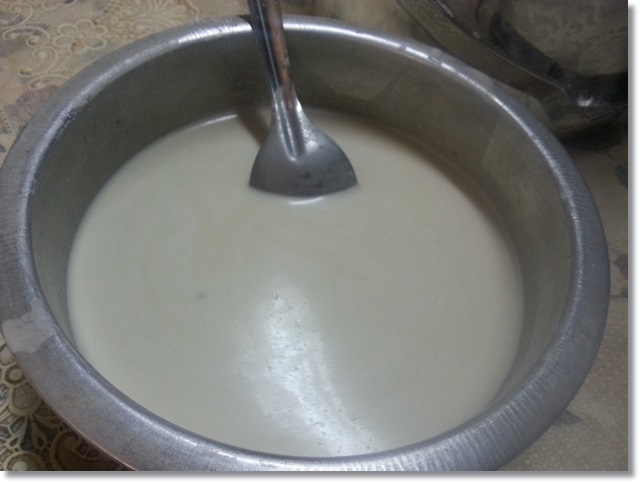
What are the coordinates of `spoon handle` in the screenshot? It's located at click(x=281, y=52).